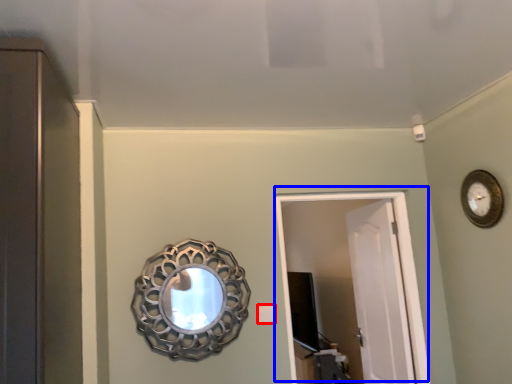
Question: Which object is further to the camera taking this photo, light switch (highlighted by a red box) or door (highlighted by a blue box)?

Choices:
 (A) light switch
 (B) door

Answer: (B)